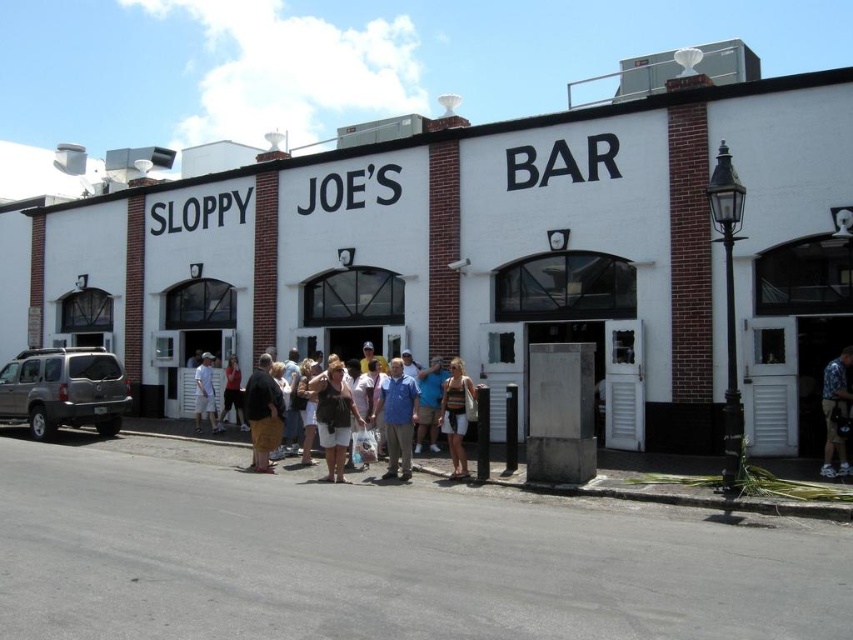
Is white brick building at center closer to the viewer compared to matte red shirt at center?

Yes, it is.

Image resolution: width=853 pixels, height=640 pixels. What do you see at coordinates (466, 248) in the screenshot?
I see `white brick building at center` at bounding box center [466, 248].

Locate an element on the screen. The width and height of the screenshot is (853, 640). white brick building at center is located at coordinates (466, 248).

Who is shorter, blue cotton shirt at center or brown cotton shorts at center?

brown cotton shorts at center

Does blue cotton shirt at center come behind brown cotton shorts at center?

No, it is not.

At what (x,y) coordinates should I click in order to perform the action: click on blue cotton shirt at center. Please return your answer as a coordinate pair (x, y). The image size is (853, 640). Looking at the image, I should click on (397, 419).

Can you confirm if matte black tank top at center is wider than floral-patterned shirt at center?

Yes.

Which is more to the right, matte black tank top at center or floral-patterned shirt at center?

floral-patterned shirt at center

You are a GUI agent. You are given a task and a screenshot of the screen. Output one action in this format:
    pyautogui.click(x=<x>, y=<y>)
    Task: Click on the matte black tank top at center
    This screenshot has width=853, height=640.
    Given the screenshot: What is the action you would take?
    pyautogui.click(x=334, y=419)

Identify the location of matte black tank top at center. This screenshot has height=640, width=853. (334, 419).